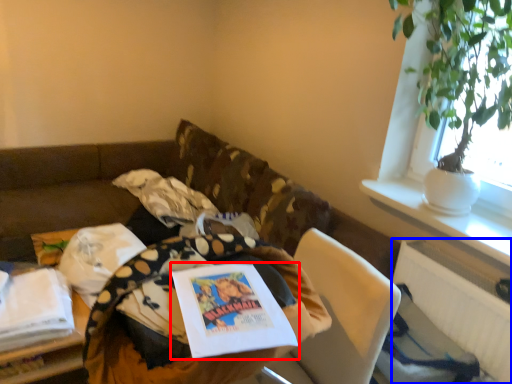
Question: Among these objects, which one is nearest to the camera, book (highlighted by a red box) or radiator (highlighted by a blue box)?

Choices:
 (A) book
 (B) radiator

Answer: (A)